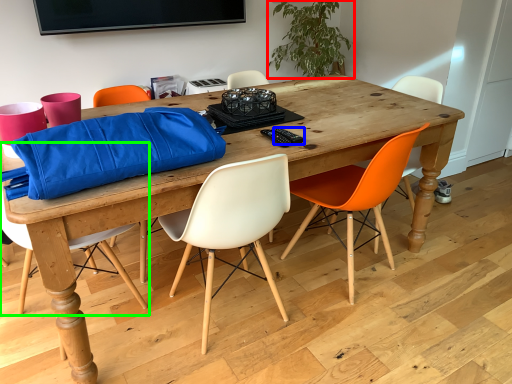
Question: Which object is positioned farthest from houseplant (highlighted by a red box)? Select from remote control (highlighted by a blue box) and chair (highlighted by a green box).

Choices:
 (A) remote control
 (B) chair

Answer: (B)